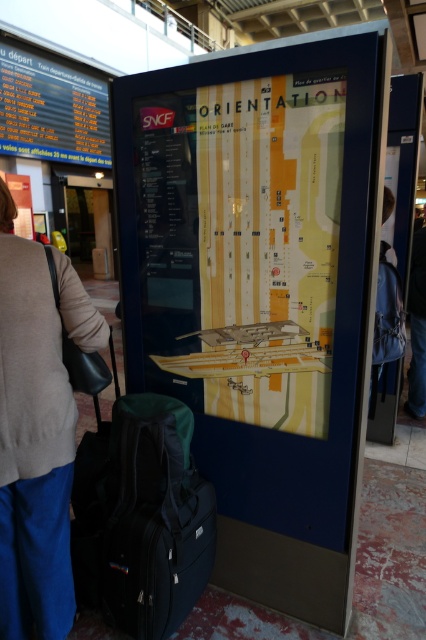
Looking at this image, you are at the train station and need to check your belongings before boarding. You have a light beige sweater at center and a black fabric suitcase at lower left. Which item takes up more horizontal space?

The black fabric suitcase at lower left takes up more horizontal space because the light beige sweater at center has a lesser width compared to it.